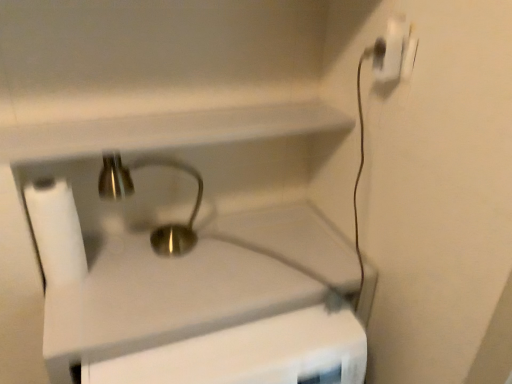
Question: From their relative heights in the image, would you say white plastic power plug at upper right is taller or shorter than polished brass faucet at center?

Choices:
 (A) tall
 (B) short

Answer: (B)

Question: Considering the positions of point 392,31 and point 119,195, is point 392,31 closer or farther from the camera than point 119,195?

Choices:
 (A) closer
 (B) farther

Answer: (A)

Question: Considering the real-world distances, which object is closest to the polished brass faucet at center?

Choices:
 (A) brass metallic sink at center
 (B) white plastic power plug at upper right
 (C) white matte toilet paper at left

Answer: (A)

Question: Based on their relative distances, which object is farther from the polished brass faucet at center?

Choices:
 (A) white plastic power plug at upper right
 (B) brass metallic sink at center
 (C) white matte toilet paper at left

Answer: (A)